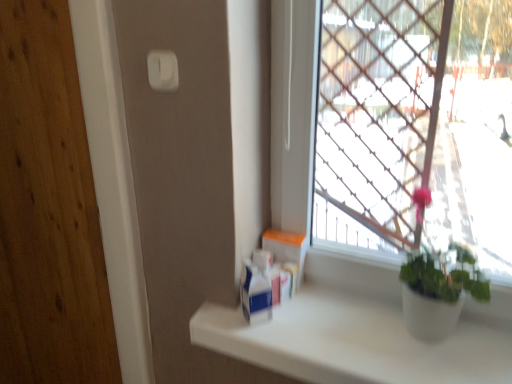
Image resolution: width=512 pixels, height=384 pixels. Describe the element at coordinates (353, 343) in the screenshot. I see `white matte counter top at lower right` at that location.

You are a GUI agent. You are given a task and a screenshot of the screen. Output one action in this format:
    pyautogui.click(x=<x>, y=<y>)
    Task: Click on the white plastic light switch at upper center
    The width and height of the screenshot is (512, 384).
    Given the screenshot: What is the action you would take?
    pyautogui.click(x=163, y=70)

Describe the element at coordinates (286, 249) in the screenshot. I see `white cardboard box at center` at that location.

Identify the location of white plastic container at center. (292, 275).

Locate an element on the screen. Image resolution: width=512 pixels, height=384 pixels. window box on the left of white plastic container at center is located at coordinates (286, 249).

Are white plastic container at center and white cardboard box at center beside each other?

Yes.

Which is more to the left, white plastic container at center or white cardboard box at center?

white cardboard box at center.

From a real-world perspective, does white matte counter top at lower right sit lower than white cardboard box at center?

Yes.

Can you confirm if white matte counter top at lower right is thinner than white cardboard box at center?

No, white matte counter top at lower right is not thinner than white cardboard box at center.

From the image's perspective, relative to white plastic container at center, is white plastic light switch at upper center above or below?

Clearly, from the image's perspective, white plastic light switch at upper center is above white plastic container at center.

From a real-world perspective, which object stands above the other?

white plastic light switch at upper center is physically above.

Where is `light switch positioned vertically above the white plastic container at center (from a real-world perspective)`? This screenshot has width=512, height=384. light switch positioned vertically above the white plastic container at center (from a real-world perspective) is located at coordinates (163, 70).

The image size is (512, 384). Find the location of `window box above the white plastic container at center (from a real-world perspective)`. window box above the white plastic container at center (from a real-world perspective) is located at coordinates (286, 249).

Considering the relative positions of white cardboard box at center and white plastic container at center in the image provided, is white cardboard box at center in front of white plastic container at center?

Yes.

Does white cardboard box at center turn towards white plastic container at center?

Yes, white cardboard box at center is turned towards white plastic container at center.

Does white matte counter top at lower right touch white plastic light switch at upper center?

They are not placed beside each other.

How distant is white matte counter top at lower right from white plastic light switch at upper center?

white matte counter top at lower right is 27.85 inches from white plastic light switch at upper center.

From the image's perspective, which object appears higher, white matte counter top at lower right or white plastic light switch at upper center?

white plastic light switch at upper center is shown above in the image.

This screenshot has height=384, width=512. I want to click on light switch on the left of the white matte counter top at lower right, so click(x=163, y=70).

Can you confirm if white plastic container at center is positioned to the right of white plastic light switch at upper center?

Yes, white plastic container at center is to the right of white plastic light switch at upper center.

Who is more distant, white plastic container at center or white plastic light switch at upper center?

Positioned behind is white plastic container at center.

Considering the relative sizes of white plastic container at center and white plastic light switch at upper center in the image provided, is white plastic container at center shorter than white plastic light switch at upper center?

In fact, white plastic container at center may be taller than white plastic light switch at upper center.

From a real-world perspective, relative to white plastic container at center, is white matte counter top at lower right vertically above or below?

From a real-world perspective, white matte counter top at lower right is physically below white plastic container at center.

From the picture: Which is behind, white matte counter top at lower right or white plastic container at center?

white plastic container at center is more distant.

Considering the positions of objects white matte counter top at lower right and white plastic container at center in the image provided, who is more to the left, white matte counter top at lower right or white plastic container at center?

white plastic container at center.

Considering the relative sizes of white matte counter top at lower right and white plastic container at center in the image provided, is white matte counter top at lower right smaller than white plastic container at center?

Actually, white matte counter top at lower right might be larger than white plastic container at center.

There is a white plastic container at center. Where is `window box above it (from a real-world perspective)`? The width and height of the screenshot is (512, 384). window box above it (from a real-world perspective) is located at coordinates (286, 249).

The image size is (512, 384). What are the coordinates of `window box behind the white matte counter top at lower right` in the screenshot? It's located at (286, 249).

Which object lies nearer to the anchor point white plastic light switch at upper center, white cardboard box at center or white plastic container at center?

white cardboard box at center is closer to white plastic light switch at upper center.

From the image, which object appears to be nearer to white cardboard box at center, white matte counter top at lower right or white plastic light switch at upper center?

The object closer to white cardboard box at center is white matte counter top at lower right.

Based on their spatial positions, is white plastic light switch at upper center or white matte counter top at lower right further from white plastic container at center?

white plastic light switch at upper center is positioned further to the anchor white plastic container at center.

Based on their spatial positions, is white cardboard box at center or white plastic container at center further from white matte counter top at lower right?

white cardboard box at center is further to white matte counter top at lower right.

Estimate the real-world distances between objects in this image. Which object is closer to white plastic container at center, white cardboard box at center or white matte counter top at lower right?

white cardboard box at center is positioned closer to the anchor white plastic container at center.

Estimate the real-world distances between objects in this image. Which object is further from white cardboard box at center, white plastic light switch at upper center or white matte counter top at lower right?

white plastic light switch at upper center is further to white cardboard box at center.

Looking at the image, which one is located closer to white cardboard box at center, white plastic light switch at upper center or white plastic container at center?

The object closer to white cardboard box at center is white plastic container at center.

Estimate the real-world distances between objects in this image. Which object is closer to white matte counter top at lower right, white plastic container at center or white plastic light switch at upper center?

white plastic container at center lies closer to white matte counter top at lower right than the other object.

Image resolution: width=512 pixels, height=384 pixels. I want to click on window box located between white matte counter top at lower right and white plastic container at center in the depth direction, so click(x=286, y=249).

Locate an element on the screen. This screenshot has height=384, width=512. window box between white plastic light switch at upper center and white matte counter top at lower right in the up-down direction is located at coordinates (286, 249).

I want to click on window box between white plastic light switch at upper center and white plastic container at center from top to bottom, so click(x=286, y=249).

The image size is (512, 384). I want to click on toiletry between white plastic light switch at upper center and white matte counter top at lower right vertically, so click(292, 275).